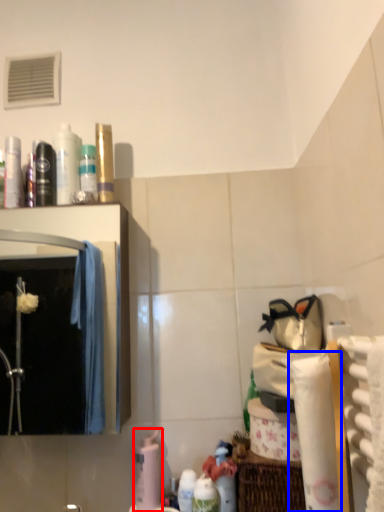
Question: Among these objects, which one is nearest to the camera, cleaning product (highlighted by a red box) or toilet paper (highlighted by a blue box)?

Choices:
 (A) cleaning product
 (B) toilet paper

Answer: (B)